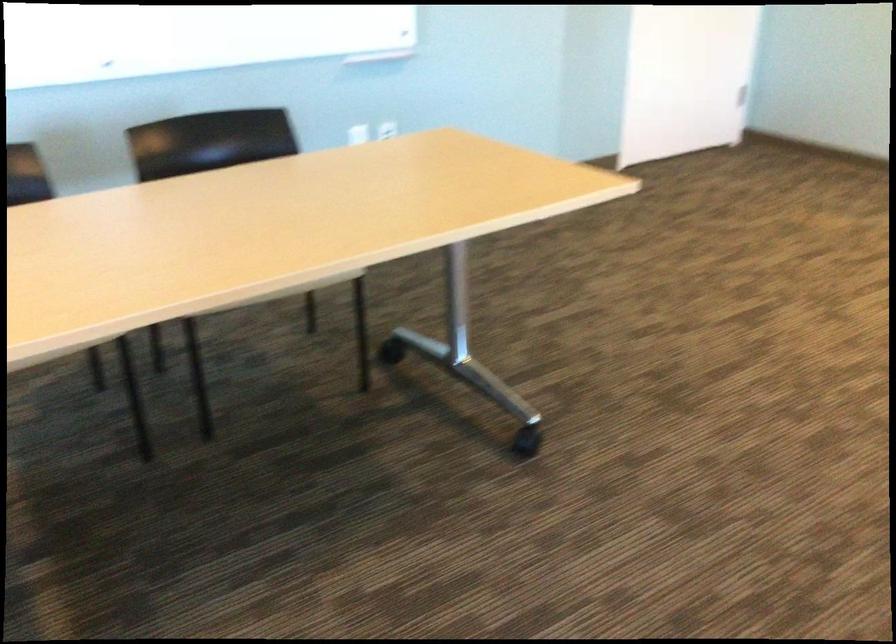
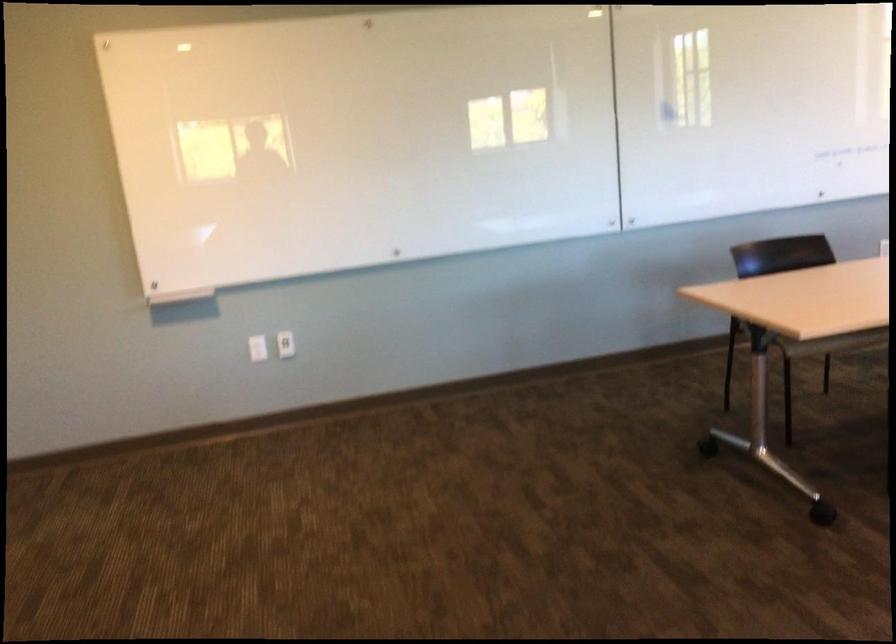
Question: Based on the continuous images, in which direction is the camera rotating? Reply with the corresponding letter.

Choices:
 (A) Left
 (B) Right
 (C) Up
 (D) Down

Answer: (B)